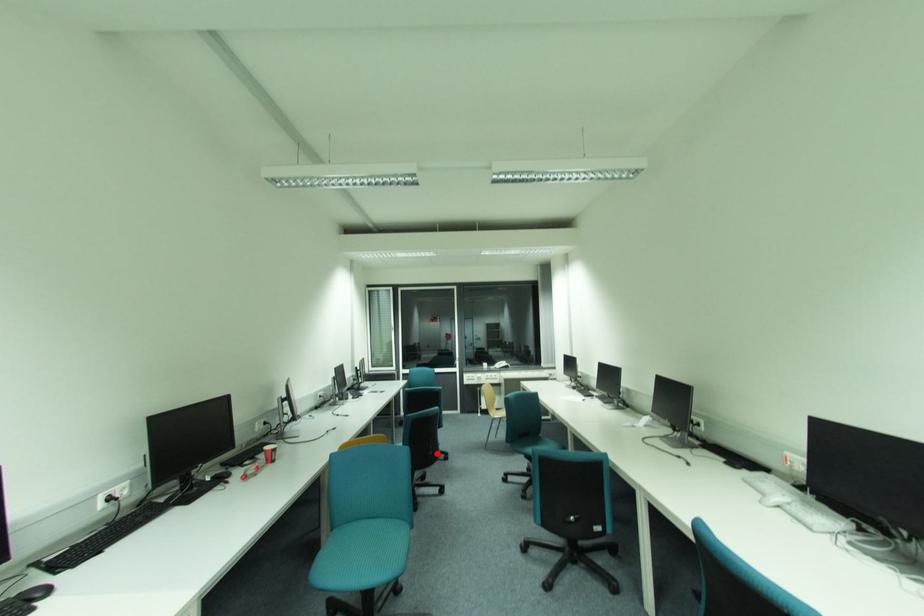
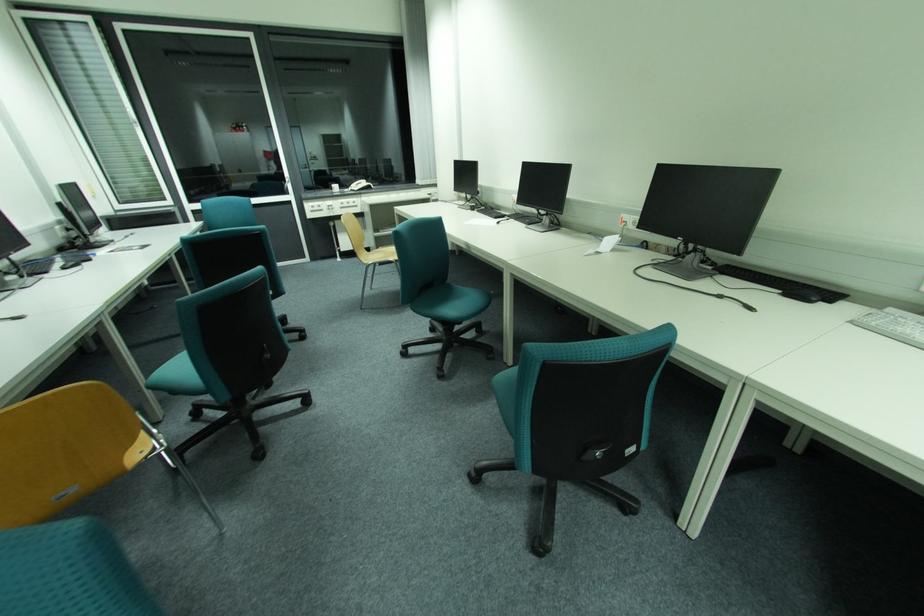
Where in the second image is the point corresponding to the highlighted location from the first image?

(273, 357)